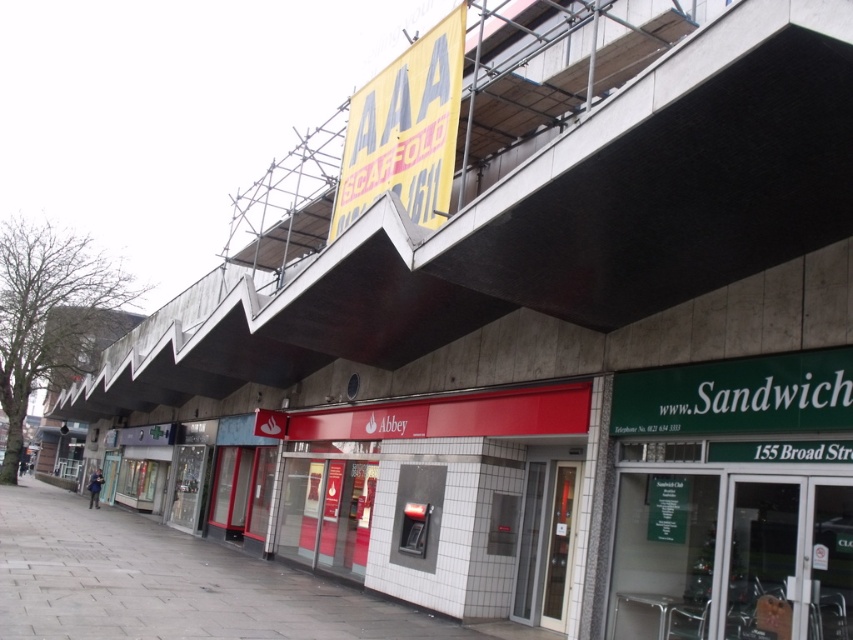
How far apart are gray concrete pavement at lower left and yellow paper sign at upper center?

gray concrete pavement at lower left is 26.76 feet away from yellow paper sign at upper center.

Does gray concrete pavement at lower left appear over yellow paper sign at upper center?

No, gray concrete pavement at lower left is not above yellow paper sign at upper center.

Is point (161, 570) positioned before point (378, 76)?

Yes, point (161, 570) is closer to viewer.

Locate an element on the screen. This screenshot has width=853, height=640. gray concrete pavement at lower left is located at coordinates (175, 584).

Does point (712, 32) come farther from viewer compared to point (447, 24)?

No, (712, 32) is in front of (447, 24).

Does concrete at upper center appear over yellow paper sign at upper center?

Incorrect, concrete at upper center is not positioned above yellow paper sign at upper center.

Which is in front, point (689, 221) or point (425, 196)?

Point (689, 221)

Where is `concrete at upper center`? concrete at upper center is located at coordinates (560, 221).

Which is more to the left, concrete at upper center or gray concrete pavement at lower left?

Positioned to the left is gray concrete pavement at lower left.

The image size is (853, 640). What do you see at coordinates (560, 221) in the screenshot? I see `concrete at upper center` at bounding box center [560, 221].

Who is more forward, (685, 216) or (454, 632)?

Point (685, 216) is in front.

Find the location of a particular element. concrete at upper center is located at coordinates (560, 221).